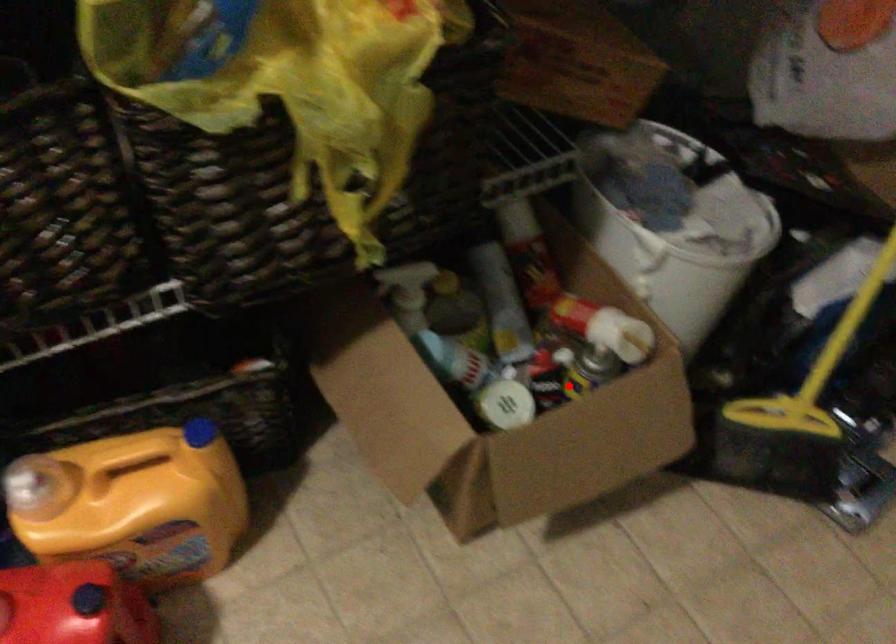
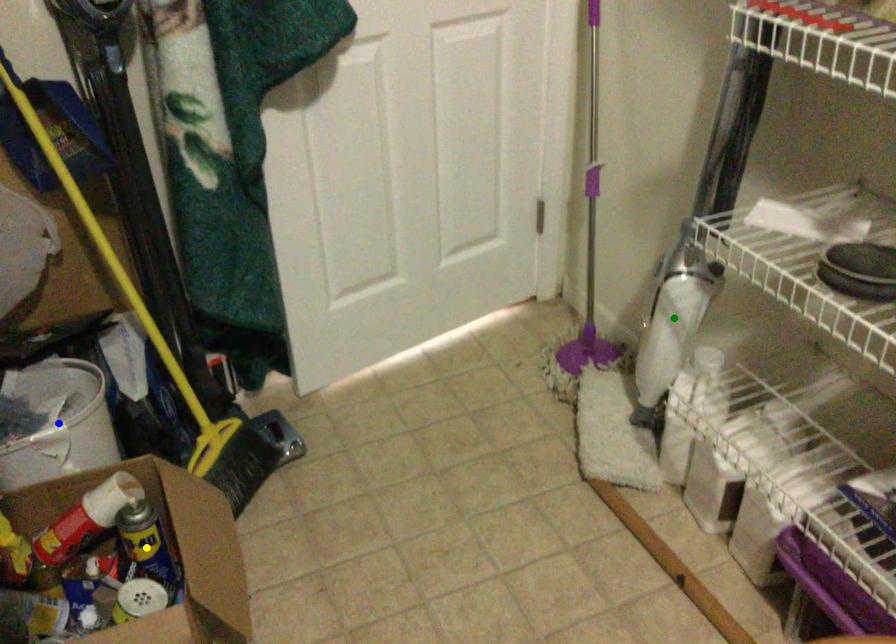
Question: I am providing you with two images of the same scene from different viewpoints. A red point is marked on the first image. You are given multiple points on the second image. Which mark in image 2 goes with the point in image 1?

Choices:
 (A) green point
 (B) blue point
 (C) yellow point

Answer: (C)